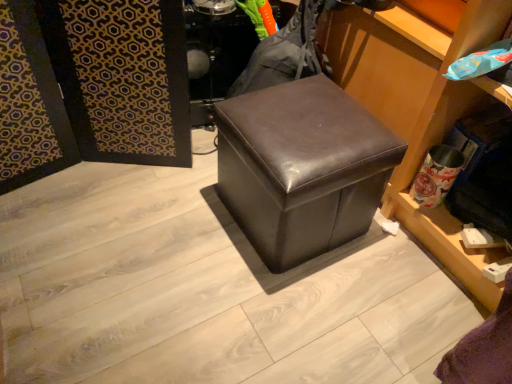
Identify the location of free point above matte brown ottoman at center (from a real-world perspective). (303, 124).